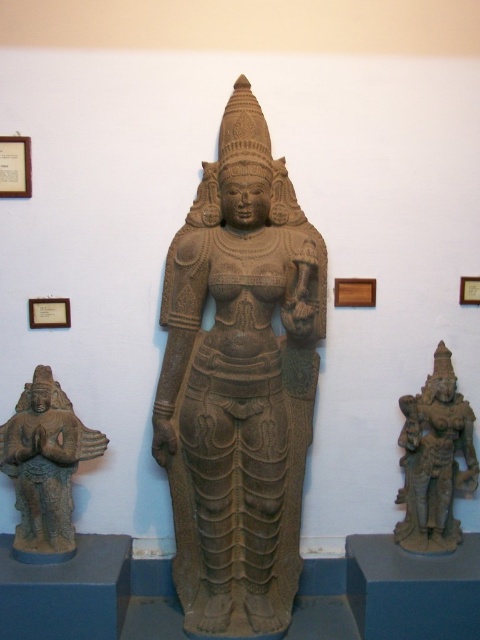
Question: Is brown stone statue at center positioned behind brown stone statue at lower right?

Choices:
 (A) no
 (B) yes

Answer: (A)

Question: Is the position of brown stone statue at center less distant than that of brown stone statue at lower right?

Choices:
 (A) no
 (B) yes

Answer: (B)

Question: Does brown stone statue at center appear on the left side of brown stone statue at lower left?

Choices:
 (A) no
 (B) yes

Answer: (A)

Question: Estimate the real-world distances between objects in this image. Which object is farther from the brown stone statue at lower left?

Choices:
 (A) brown stone statue at lower right
 (B) brown stone statue at center

Answer: (A)

Question: Which object is farther from the camera taking this photo?

Choices:
 (A) brown stone statue at lower right
 (B) brown stone statue at center

Answer: (A)

Question: Which object is the farthest from the brown stone statue at lower right?

Choices:
 (A) brown stone statue at lower left
 (B) brown stone statue at center

Answer: (A)